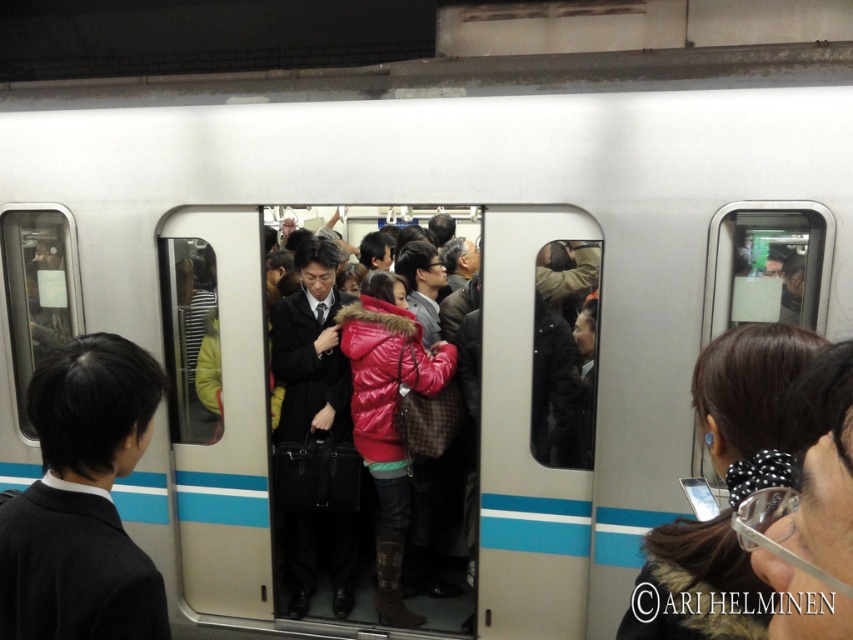
You are a passenger on a subway train and you see two items of clothing, the black matte sweater at left and the shiny red jacket at center. Which clothing item is located higher up in the scene?

The black matte sweater at left is positioned over the shiny red jacket at center, so it is located higher up in the scene.

You are a photographer trying to capture a candid shot of the black matte sweater at left and the black textured hair at upper right in the subway scene. Which object should you focus on first if you want to ensure both are in the frame without moving your camera?

You should focus on the black textured hair at upper right first because the black matte sweater at left is located below it, so adjusting the framing to include the upper part first will naturally include the lower positioned sweater in the shot.